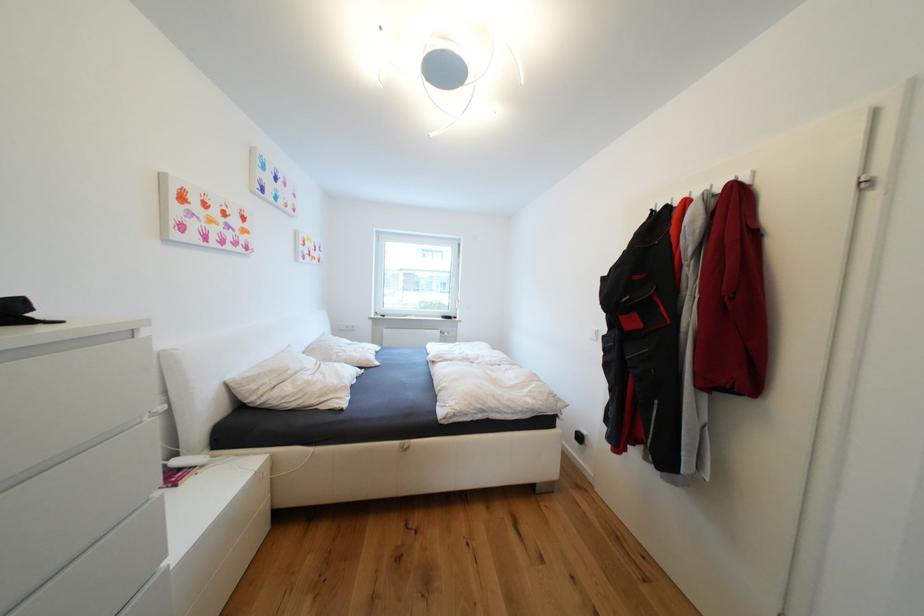
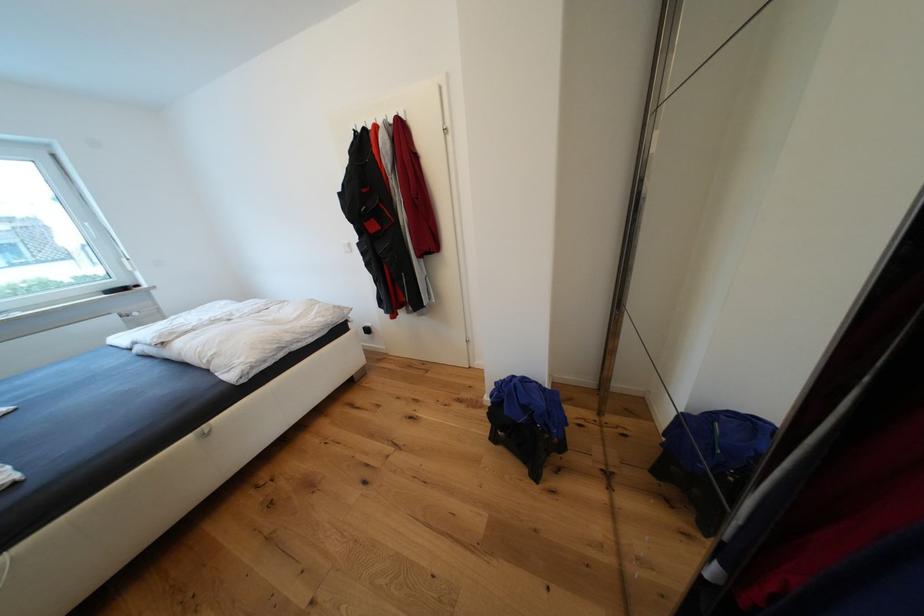
First-person continuous shooting, in which direction is the camera rotating?

The rotation direction of the camera is right-down.